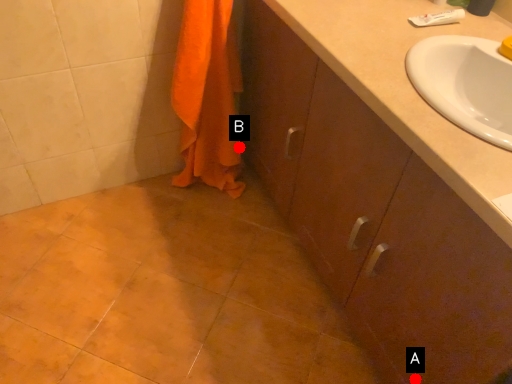
Question: Two points are circled on the image, labeled by A and B beside each circle. Which of the following is the farthest from the observer?

Choices:
 (A) A is further
 (B) B is further

Answer: (B)